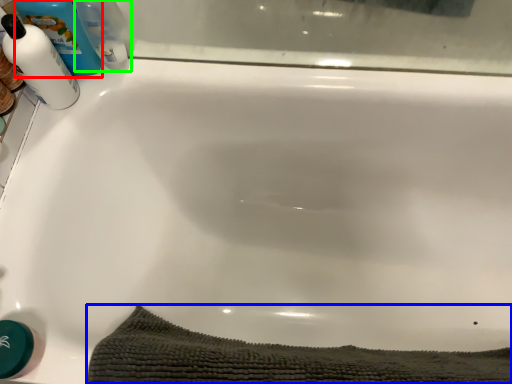
Question: Which is farther away from cleaning product (highlighted by a red box)? bath towel (highlighted by a blue box) or cleaning product (highlighted by a green box)?

Choices:
 (A) bath towel
 (B) cleaning product

Answer: (A)